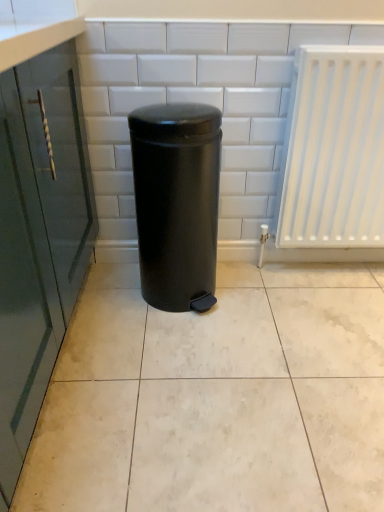
Locate an element on the screen. Image resolution: width=384 pixels, height=512 pixels. free location to the left of black matte waste container at center is located at coordinates (105, 311).